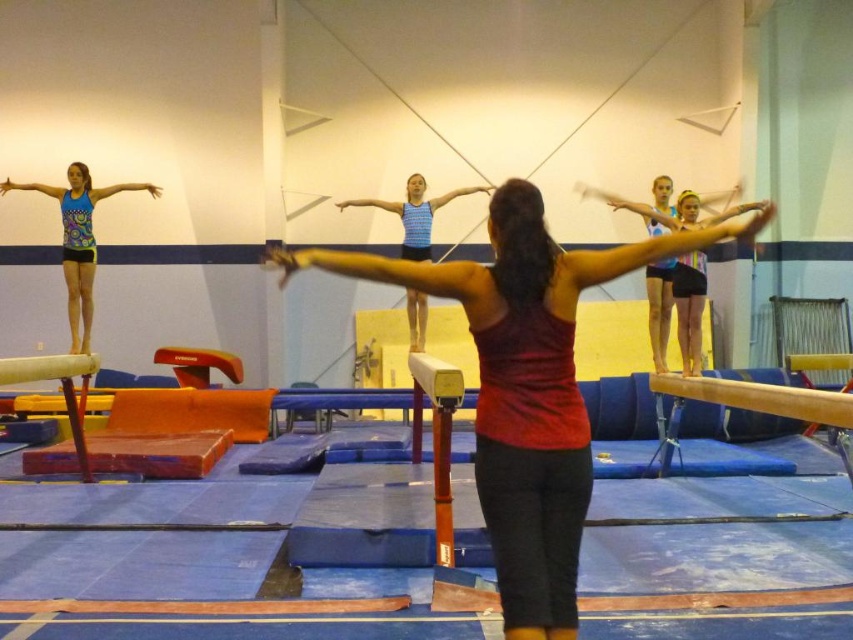
Does red matte tank top at center have a greater width compared to matte blue tank top at left?

Yes, red matte tank top at center is wider than matte blue tank top at left.

How distant is red matte tank top at center from matte blue tank top at left?

A distance of 18.55 feet exists between red matte tank top at center and matte blue tank top at left.

Find the location of `red matte tank top at center`. red matte tank top at center is located at coordinates (525, 385).

Is red matte tank top at center to the right of blue striped tank top at center from the viewer's perspective?

Yes, red matte tank top at center is to the right of blue striped tank top at center.

Does red matte tank top at center appear under blue striped tank top at center?

Correct, red matte tank top at center is located below blue striped tank top at center.

Does point (517, 360) lie behind point (421, 230)?

No, (517, 360) is in front of (421, 230).

Locate an element on the screen. This screenshot has height=640, width=853. red matte tank top at center is located at coordinates click(x=525, y=385).

Is point (764, 397) more distant than point (9, 358)?

No, (764, 397) is closer to viewer.

Does point (727, 384) come in front of point (28, 358)?

Yes, it is.

Does point (822, 390) lie behind point (97, 369)?

Yes, point (822, 390) is behind point (97, 369).

You are a GUI agent. You are given a task and a screenshot of the screen. Output one action in this format:
    pyautogui.click(x=<x>, y=<y>)
    Task: Click on the wooden beam at right
    The image size is (853, 640).
    Given the screenshot: What is the action you would take?
    pyautogui.click(x=758, y=397)